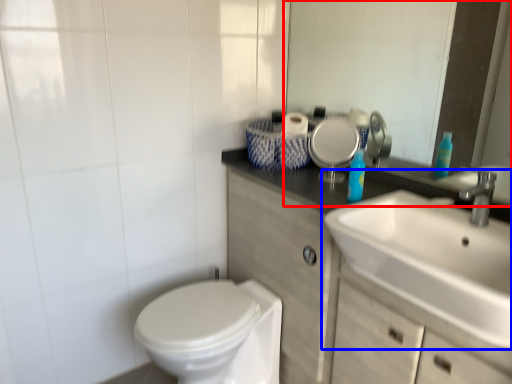
Question: Which object appears closest to the camera in this image, mirror (highlighted by a red box) or sink (highlighted by a blue box)?

Choices:
 (A) mirror
 (B) sink

Answer: (B)